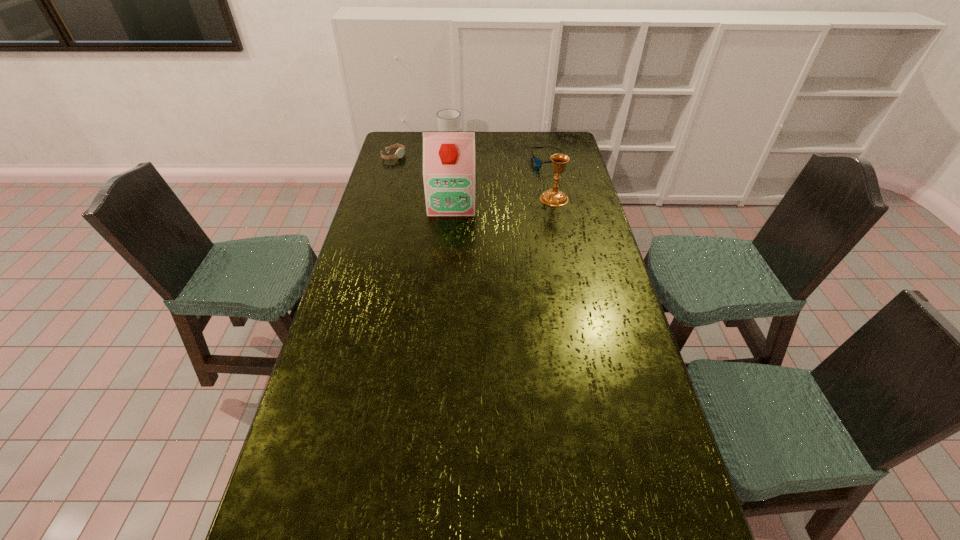
Image resolution: width=960 pixels, height=540 pixels. In order to click on vacant space situated with a handle on the side of the third shortest object in this screenshot , I will do `click(476, 166)`.

You are a GUI agent. You are given a task and a screenshot of the screen. Output one action in this format:
    pyautogui.click(x=<x>, y=<y>)
    Task: Click on the free spot located 0.300m with a handle on the side of the third shortest object
    
    Given the screenshot: What is the action you would take?
    (x=489, y=177)

Where is `blank space located on the face of the second shortest object`? This screenshot has height=540, width=960. blank space located on the face of the second shortest object is located at coordinates (438, 174).

Identify the location of free region located 0.100m on the face of the second shortest object. This screenshot has width=960, height=540. (418, 166).

The height and width of the screenshot is (540, 960). Identify the location of free spot located on the face of the second shortest object. (443, 177).

The image size is (960, 540). Identify the location of vacant space located at the front of the shortest object showing the lenses. (505, 192).

This screenshot has width=960, height=540. I want to click on vacant space situated at the front of the shortest object showing the lenses, so click(x=527, y=177).

At what (x,y) coordinates should I click in order to perform the action: click on free region located at the front of the shortest object showing the lenses. Please return your answer as a coordinate pair (x, y). The image size is (960, 540). Looking at the image, I should click on (499, 195).

Find the location of `cup that is at the far edge`. cup that is at the far edge is located at coordinates (448, 119).

Locate an element on the screen. Image resolution: width=960 pixels, height=540 pixels. watch that is positioned at the far edge is located at coordinates (400, 152).